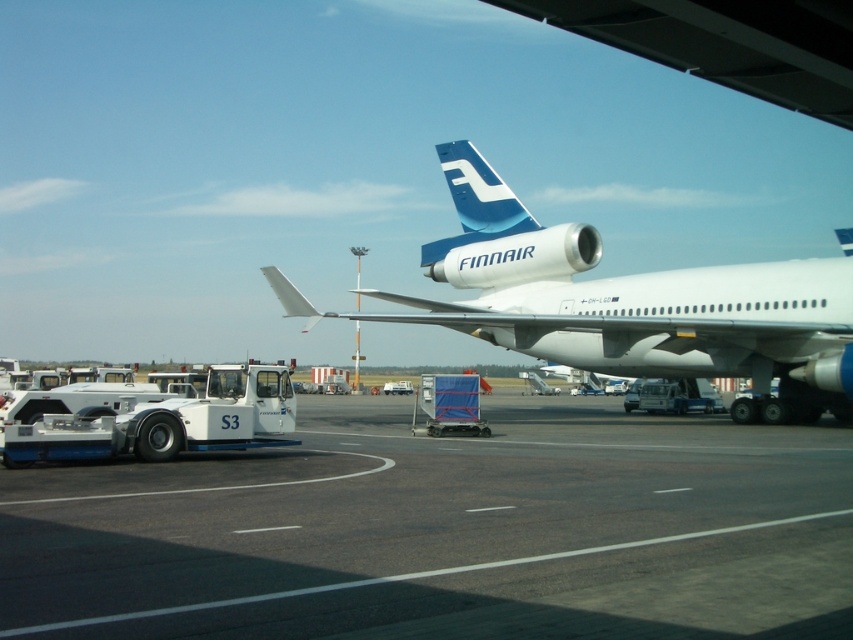
What is the location of the black asphalt tarmac at center in the image?

The black asphalt tarmac at center is located at point [445,531].

You are a ground crew member who needs to attach a tow bar to the nose gear of the white glossy airplane at center. The tow bar you have can extend up to 5 meters. Based on the scene, will the tow bar reach the blue glossy finnair tail at upper center from the airplane?

The distance between the white glossy airplane at center and the blue glossy finnair tail at upper center is 5.74 meters. Since the tow bar can only extend up to 5 meters, it will not be long enough to reach the blue glossy finnair tail at upper center from the airplane.